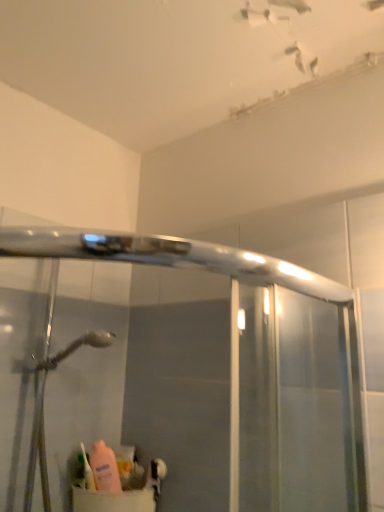
What do you see at coordinates (115, 500) in the screenshot? The height and width of the screenshot is (512, 384). I see `pink matte sink at lower left` at bounding box center [115, 500].

Find the location of a particular element. This screenshot has height=512, width=384. pink matte sink at lower left is located at coordinates [115, 500].

What is the approximate height of pink matte sink at lower left?

4.09 inches.

Image resolution: width=384 pixels, height=512 pixels. I want to click on translucent plastic toothbrush at lower left, so click(x=87, y=471).

The height and width of the screenshot is (512, 384). What do you see at coordinates (87, 471) in the screenshot?
I see `translucent plastic toothbrush at lower left` at bounding box center [87, 471].

Identify the location of pink matte sink at lower left. (x=115, y=500).

Considering the relative positions of pink matte sink at lower left and translucent plastic toothbrush at lower left in the image provided, is pink matte sink at lower left to the right of translucent plastic toothbrush at lower left from the viewer's perspective?

Indeed, pink matte sink at lower left is positioned on the right side of translucent plastic toothbrush at lower left.

Is the position of pink matte sink at lower left more distant than that of translucent plastic toothbrush at lower left?

No.

Does point (142, 507) lie behind point (85, 483)?

No, it is not.

Looking at this image, from the image's perspective, who appears lower, pink matte sink at lower left or translucent plastic toothbrush at lower left?

pink matte sink at lower left appears lower in the image.

From a real-world perspective, who is located higher, pink matte sink at lower left or translucent plastic toothbrush at lower left?

From a 3D spatial view, translucent plastic toothbrush at lower left is above.

Between pink matte sink at lower left and translucent plastic toothbrush at lower left, which one has larger width?

With larger width is pink matte sink at lower left.

Is pink matte sink at lower left taller than translucent plastic toothbrush at lower left?

Incorrect, the height of pink matte sink at lower left is not larger of that of translucent plastic toothbrush at lower left.

Which of these two, pink matte sink at lower left or translucent plastic toothbrush at lower left, is bigger?

Bigger between the two is pink matte sink at lower left.

Is pink matte sink at lower left outside of translucent plastic toothbrush at lower left?

That's correct, pink matte sink at lower left is outside of translucent plastic toothbrush at lower left.

Is pink matte sink at lower left beside translucent plastic toothbrush at lower left?

Indeed, pink matte sink at lower left and translucent plastic toothbrush at lower left are beside each other and touching.

Could you tell me if pink matte sink at lower left is facing translucent plastic toothbrush at lower left?

No, pink matte sink at lower left does not turn towards translucent plastic toothbrush at lower left.

What's the angular difference between pink matte sink at lower left and translucent plastic toothbrush at lower left's facing directions?

pink matte sink at lower left and translucent plastic toothbrush at lower left are facing 4.29 degrees away from each other.

Where is `toiletry that is above the pink matte sink at lower left (from the image's perspective)`? Image resolution: width=384 pixels, height=512 pixels. toiletry that is above the pink matte sink at lower left (from the image's perspective) is located at coordinates (87, 471).

Between translucent plastic toothbrush at lower left and pink matte sink at lower left, which one appears on the right side from the viewer's perspective?

Positioned to the right is pink matte sink at lower left.

Is translucent plastic toothbrush at lower left closer to camera compared to pink matte sink at lower left?

That is False.

Is point (90, 480) positioned in front of point (114, 494)?

Yes.

From the image's perspective, is translucent plastic toothbrush at lower left positioned above or below pink matte sink at lower left?

translucent plastic toothbrush at lower left is above pink matte sink at lower left.

From a real-world perspective, is translucent plastic toothbrush at lower left located beneath pink matte sink at lower left?

No, from a real-world perspective, translucent plastic toothbrush at lower left is not beneath pink matte sink at lower left.

Can you confirm if translucent plastic toothbrush at lower left is thinner than pink matte sink at lower left?

Yes, translucent plastic toothbrush at lower left is thinner than pink matte sink at lower left.

Which of these two, translucent plastic toothbrush at lower left or pink matte sink at lower left, stands taller?

translucent plastic toothbrush at lower left.

Does translucent plastic toothbrush at lower left have a smaller size compared to pink matte sink at lower left?

Yes.

Is translucent plastic toothbrush at lower left not within pink matte sink at lower left?

Yes, translucent plastic toothbrush at lower left is outside of pink matte sink at lower left.

Would you consider translucent plastic toothbrush at lower left to be distant from pink matte sink at lower left?

They are positioned close to each other.

Is translucent plastic toothbrush at lower left facing towards pink matte sink at lower left?

No, translucent plastic toothbrush at lower left is not oriented towards pink matte sink at lower left.

Can you tell me how much translucent plastic toothbrush at lower left and pink matte sink at lower left differ in facing direction?

The facing directions of translucent plastic toothbrush at lower left and pink matte sink at lower left are 4.29 degrees apart.

Measure the distance from translucent plastic toothbrush at lower left to pink matte sink at lower left.

A distance of 3.25 inches exists between translucent plastic toothbrush at lower left and pink matte sink at lower left.

Identify the location of toiletry that appears behind the pink matte sink at lower left. The height and width of the screenshot is (512, 384). pos(87,471).

In order to click on toiletry behind the pink matte sink at lower left in this screenshot , I will do click(x=87, y=471).

Find the location of a particular element. sink in front of the translucent plastic toothbrush at lower left is located at coordinates (115, 500).